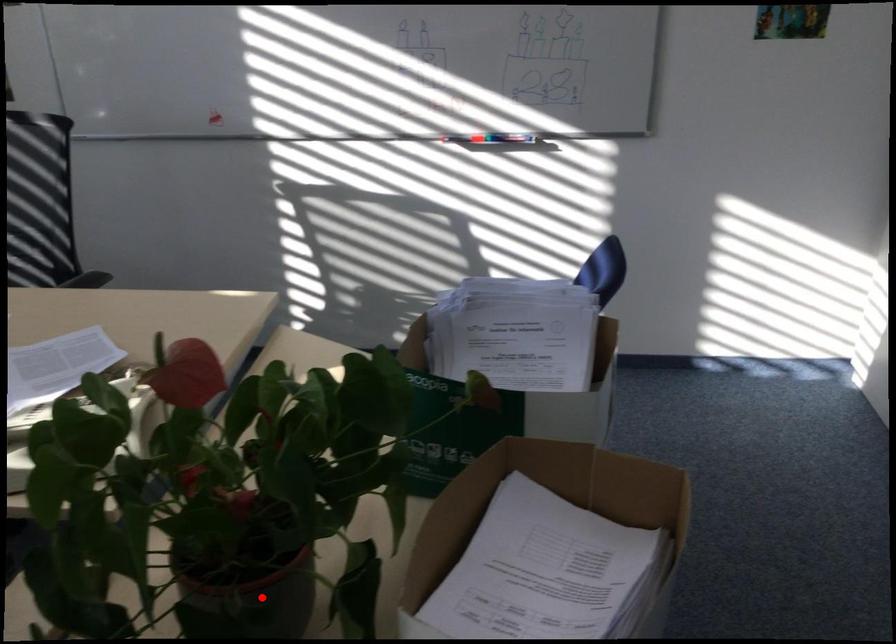
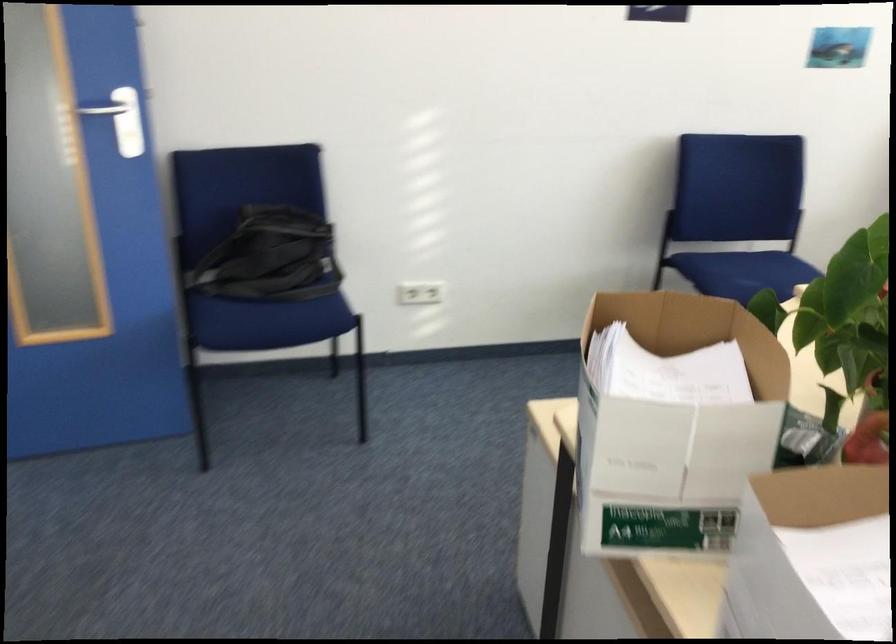
Question: I am providing you with two images of the same scene from different viewpoints. A red point is marked on the first image. Can you still see the location of the red point in image 2?

Choices:
 (A) Yes
 (B) No

Answer: (B)